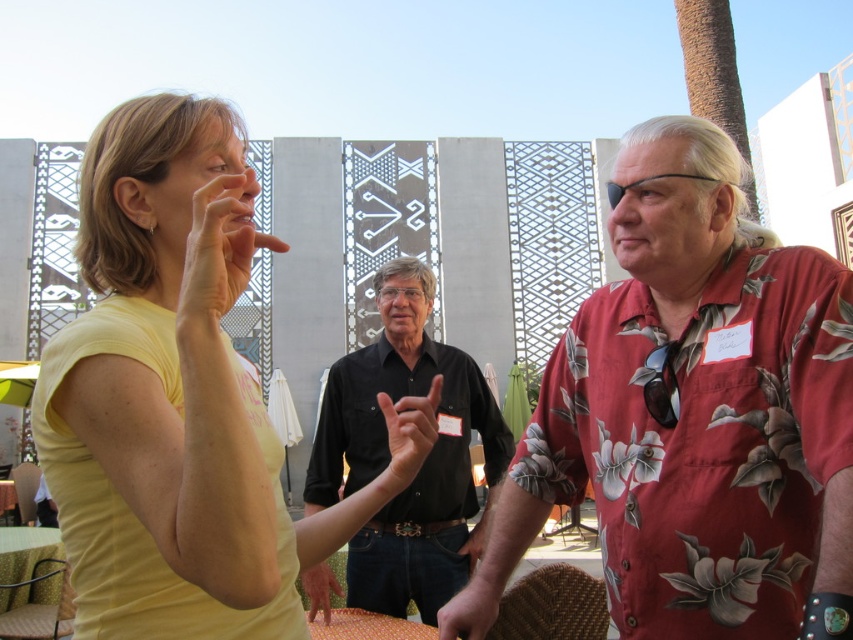
Measure the distance between black cotton shirt at center and smooth leather hand at center.

They are 50.03 feet apart.

What do you see at coordinates (424, 460) in the screenshot?
I see `black cotton shirt at center` at bounding box center [424, 460].

Is point (463, 570) positioned after point (483, 588)?

Yes, it is behind point (483, 588).

At what (x,y) coordinates should I click in order to perform the action: click on black cotton shirt at center. Please return your answer as a coordinate pair (x, y). The width and height of the screenshot is (853, 640). Looking at the image, I should click on (424, 460).

Is matte yellow hand at upper center wider than smooth skin hand at center?

Yes.

This screenshot has height=640, width=853. Describe the element at coordinates (219, 248) in the screenshot. I see `matte yellow hand at upper center` at that location.

Does point (225, 204) lie behind point (323, 588)?

No, it is in front of (323, 588).

Find the location of `matte yellow hand at upper center`. matte yellow hand at upper center is located at coordinates [x=219, y=248].

Can you confirm if yellow matte shirt at upper left is positioned to the right of matte black hand at center?

Incorrect, yellow matte shirt at upper left is not on the right side of matte black hand at center.

Find the location of a particular element. Image resolution: width=853 pixels, height=640 pixels. yellow matte shirt at upper left is located at coordinates (171, 396).